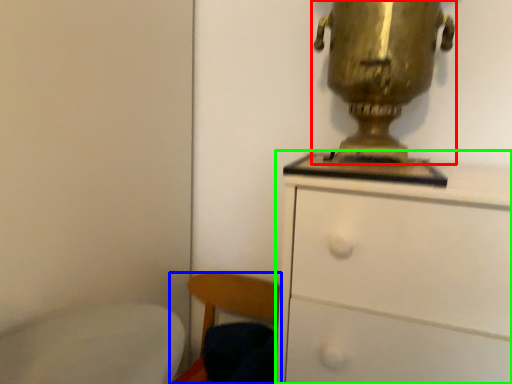
Question: Considering the real-world distances, which object is closest to table lamp (highlighted by a red box)? chair (highlighted by a blue box) or chest of drawers (highlighted by a green box).

Choices:
 (A) chair
 (B) chest of drawers

Answer: (B)